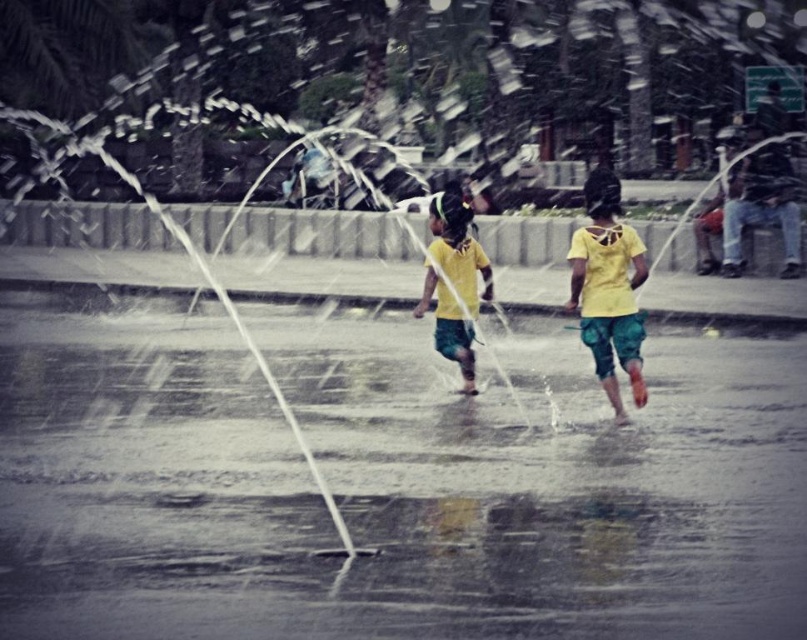
Question: Does yellow fabric shorts at center appear on the right side of yellow matte shirt at center?

Choices:
 (A) no
 (B) yes

Answer: (B)

Question: Among these objects, which one is nearest to the camera?

Choices:
 (A) yellow fabric shorts at center
 (B) clear water at center
 (C) yellow matte shirt at center

Answer: (B)

Question: Which point is closer to the camera?

Choices:
 (A) yellow fabric shorts at center
 (B) yellow matte shirt at center

Answer: (A)

Question: Observing the image, what is the correct spatial positioning of yellow fabric shorts at center in reference to yellow matte shirt at center?

Choices:
 (A) below
 (B) above

Answer: (A)

Question: In this image, where is yellow fabric shorts at center located relative to yellow matte shirt at center?

Choices:
 (A) below
 (B) above

Answer: (A)

Question: Which object is the farthest from the yellow matte shirt at center?

Choices:
 (A) clear water at center
 (B) yellow fabric shorts at center

Answer: (A)